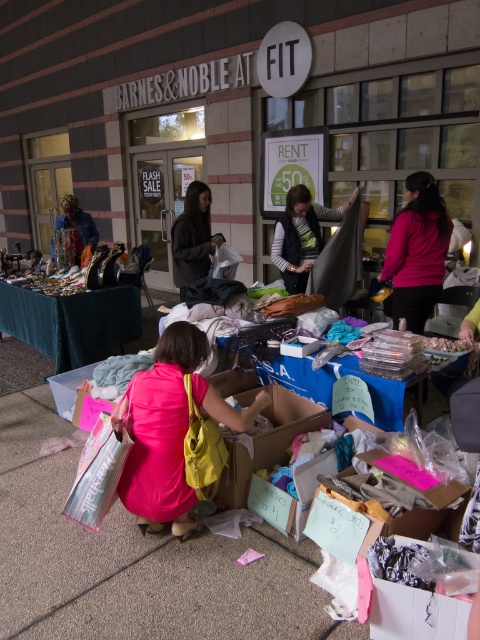
Describe the element at coordinates (300, 236) in the screenshot. I see `velvet green scarf at center` at that location.

Who is lower down, velvet green scarf at center or dark brown hair at center?

dark brown hair at center is lower down.

Is point (322, 212) positioned after point (208, 205)?

Yes, it is behind point (208, 205).

The width and height of the screenshot is (480, 640). Identify the location of velvet green scarf at center. (300, 236).

Can you confirm if pink fabric dress at center is smaller than dark brown hair at center?

No, pink fabric dress at center is not smaller than dark brown hair at center.

Is pink fabric dress at center shorter than dark brown hair at center?

Yes, pink fabric dress at center is shorter than dark brown hair at center.

The width and height of the screenshot is (480, 640). Describe the element at coordinates (169, 428) in the screenshot. I see `pink fabric dress at center` at that location.

Where is `pink fabric dress at center`? This screenshot has width=480, height=640. pink fabric dress at center is located at coordinates (169, 428).

Who is taller, pink fabric dress at center or velvet green scarf at center?

velvet green scarf at center

Does pink fabric dress at center have a smaller size compared to velvet green scarf at center?

Yes.

I want to click on pink fabric dress at center, so click(169, 428).